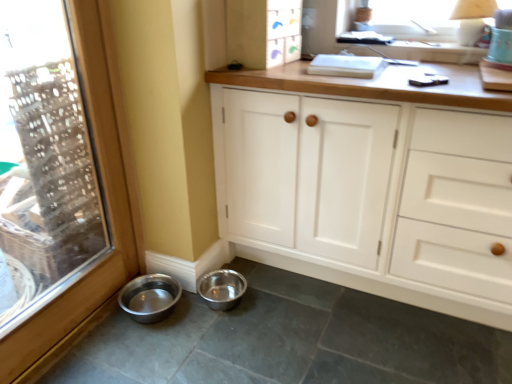
Question: Is transparent glass window at left inside or outside of metal bowls at lower left?

Choices:
 (A) outside
 (B) inside

Answer: (A)

Question: From the image's perspective, is transparent glass window at left located above or below metal bowls at lower left?

Choices:
 (A) above
 (B) below

Answer: (A)

Question: Considering the real-world distances, which object is closest to the metal bowls at lower left?

Choices:
 (A) metallic silver bowl at lower left, which is counted as the first basin, starting from the left
 (B) white wood cabinet at upper center, positioned as the second cabinetry in bottom-to-top order
 (C) metallic silver bowl at lower left, acting as the second basin starting from the left
 (D) white wood cabinet at center, the 1th cabinetry from the bottom
 (E) transparent glass window at left

Answer: (C)

Question: Which is farther from the white wood cabinet at upper center, positioned as the second cabinetry in bottom-to-top order?

Choices:
 (A) metallic silver bowl at lower left, the first basin in the right-to-left sequence
 (B) metallic silver bowl at lower left, which is counted as the first basin, starting from the left
 (C) white wood cabinet at center, the 1th cabinetry from the bottom
 (D) transparent glass window at left
 (E) metal bowls at lower left

Answer: (E)